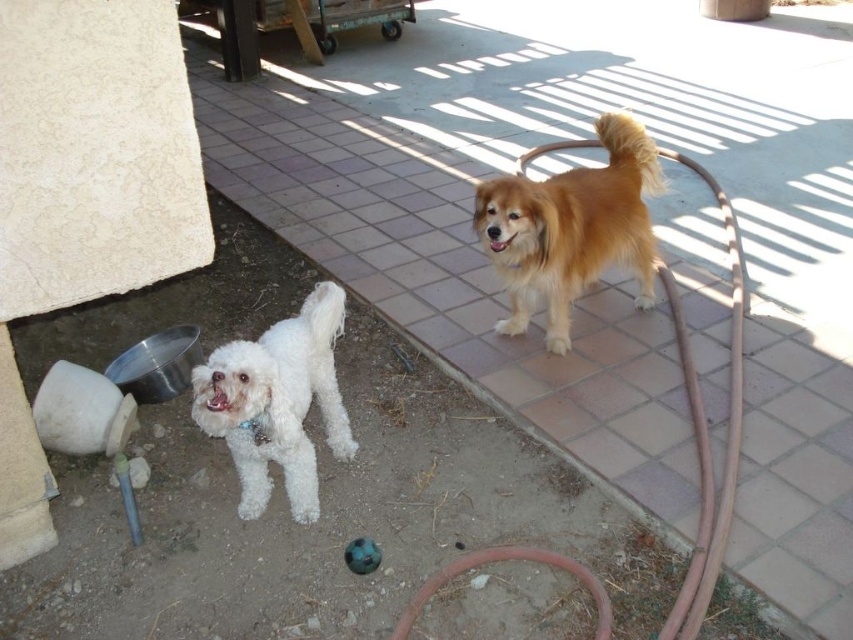
Who is more distant from viewer, [563,209] or [445,572]?

Point [563,209]

Between golden fur dog at upper right and rubber hose at lower center, which one appears on the right side from the viewer's perspective?

From the viewer's perspective, golden fur dog at upper right appears more on the right side.

You are a GUI agent. You are given a task and a screenshot of the screen. Output one action in this format:
    pyautogui.click(x=<x>, y=<y>)
    Task: Click on the golden fur dog at upper right
    The width and height of the screenshot is (853, 640).
    Given the screenshot: What is the action you would take?
    pyautogui.click(x=572, y=228)

This screenshot has width=853, height=640. In order to click on golden fur dog at upper right in this screenshot , I will do `click(572, 228)`.

Is brown rubber hose at upper right to the left of rubber hose at lower center from the viewer's perspective?

Incorrect, brown rubber hose at upper right is not on the left side of rubber hose at lower center.

Is brown rubber hose at upper right below rubber hose at lower center?

Incorrect, brown rubber hose at upper right is not positioned below rubber hose at lower center.

This screenshot has width=853, height=640. What are the coordinates of `brown rubber hose at upper right` in the screenshot? It's located at (706, 433).

You are a GUI agent. You are given a task and a screenshot of the screen. Output one action in this format:
    pyautogui.click(x=<x>, y=<y>)
    Task: Click on the brown rubber hose at upper right
    This screenshot has width=853, height=640.
    Given the screenshot: What is the action you would take?
    pyautogui.click(x=706, y=433)

Is golden fur dog at upper right thinner than white fluffy dog at lower left?

No, golden fur dog at upper right is not thinner than white fluffy dog at lower left.

Can you confirm if golden fur dog at upper right is positioned below white fluffy dog at lower left?

Actually, golden fur dog at upper right is above white fluffy dog at lower left.

Locate an element on the screen. The height and width of the screenshot is (640, 853). golden fur dog at upper right is located at coordinates (572, 228).